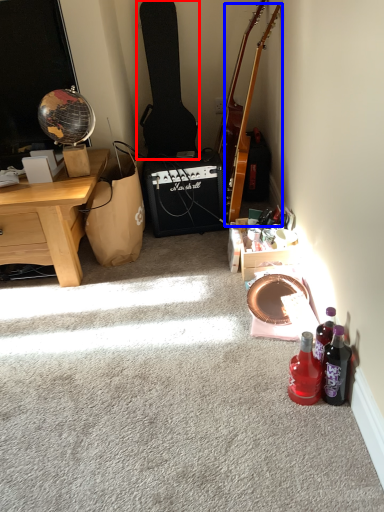
Question: Which object appears closest to the camera in this image, guitar (highlighted by a red box) or guitar (highlighted by a blue box)?

Choices:
 (A) guitar
 (B) guitar

Answer: (B)